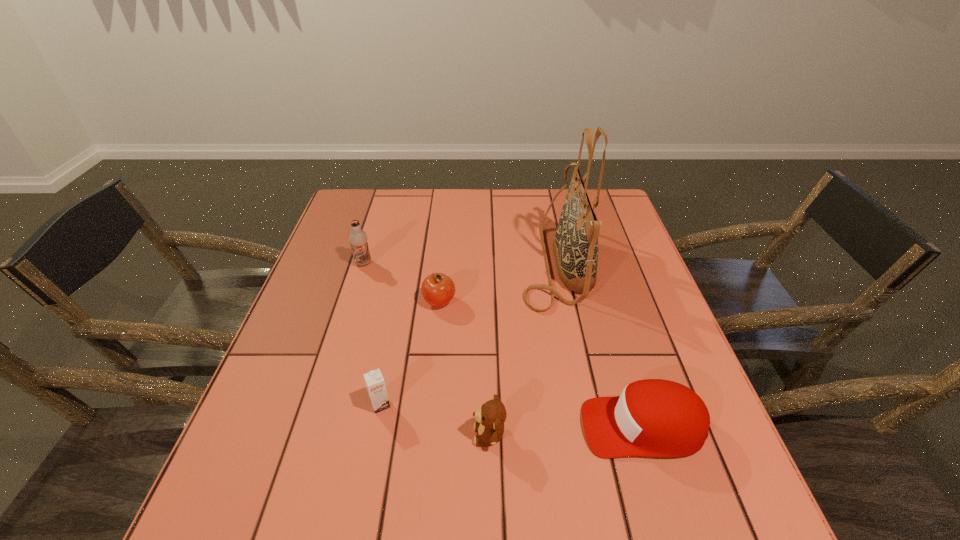
Identify the location of the tallest object. (575, 246).

The image size is (960, 540). Find the location of `the second tallest object`. the second tallest object is located at coordinates (358, 238).

This screenshot has width=960, height=540. Identify the location of the left chocolate milk. (358, 238).

This screenshot has width=960, height=540. Find the location of `apple`. apple is located at coordinates (438, 289).

Locate an element on the screen. baseball cap is located at coordinates (653, 417).

Where is `teddy bear`? Image resolution: width=960 pixels, height=540 pixels. teddy bear is located at coordinates (490, 418).

Identify the location of the right chocolate milk. (375, 383).

Locate an element on the screen. This screenshot has width=960, height=540. the second object from left to right is located at coordinates (375, 383).

Where is `free space located 0.100m on the front-facing side of the tallest object`? This screenshot has width=960, height=540. free space located 0.100m on the front-facing side of the tallest object is located at coordinates (485, 262).

You are a GUI agent. You are given a task and a screenshot of the screen. Output one action in this format:
    pyautogui.click(x=<x>, y=<y>)
    Task: Click on the free space located on the front-facing side of the tallest object
    Image resolution: width=960 pixels, height=540 pixels.
    Given the screenshot: What is the action you would take?
    pyautogui.click(x=481, y=262)